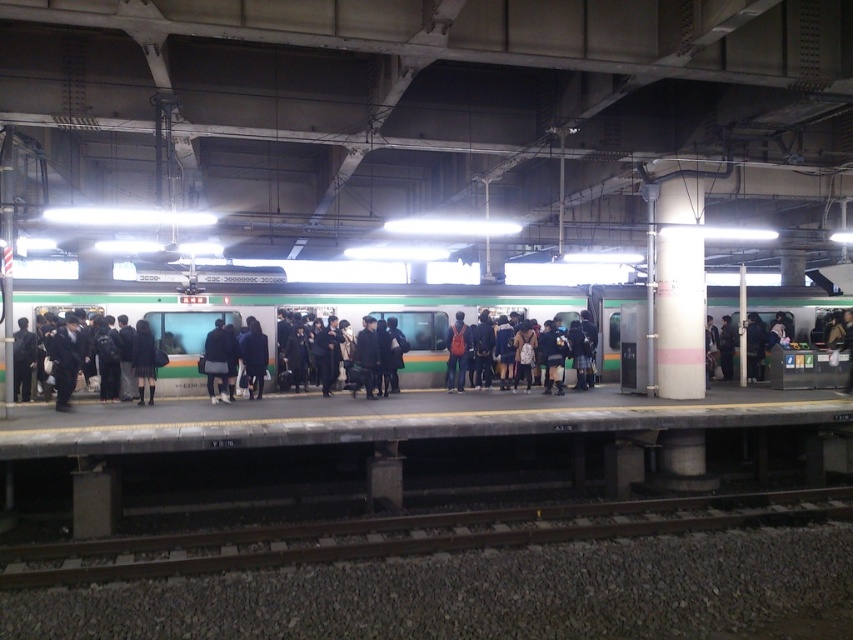
You are a passenger trying to board the green matte train at center. There is a person wearing a dark gray fabric jacket at center blocking your path. Can you walk around them without bending down?

The green matte train at center is much taller than the dark gray fabric jacket at center, so yes, you can walk around the person wearing the dark gray fabric jacket at center without bending down since there is enough vertical clearance between them and the train.

Looking at this image, you are a commuter waiting at the train station. You notice the green matte train at center and the dark gray fabric jacket at center. Which object is larger in size?

The green matte train at center is bigger than the dark gray fabric jacket at center.

You are a passenger waiting to board the train. You notice a smooth metal train track at lower center and a matte black skirt at center. Which object is bigger in size?

The smooth metal train track at lower center is larger in size than the matte black skirt at center.